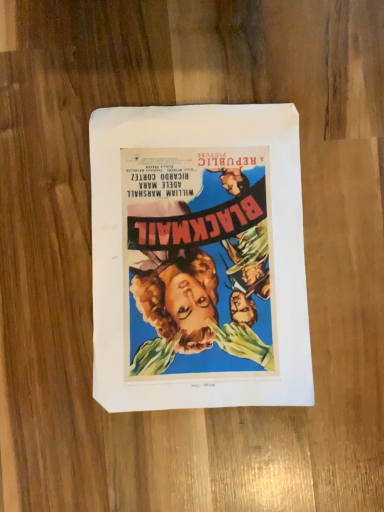
Find the location of a particular element. This screenshot has width=384, height=512. vacant space situated above matte paper poster at center (from a real-world perspective) is located at coordinates (201, 250).